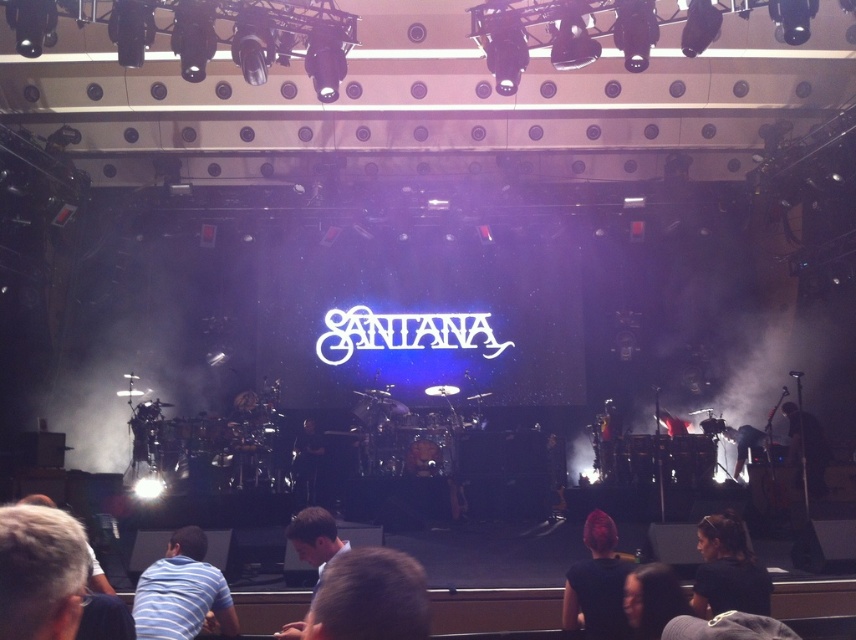
Does pink hair at center have a lesser height compared to light brown hair at lower center?

No.

Can you confirm if pink hair at center is positioned to the right of light brown hair at lower center?

Correct, you'll find pink hair at center to the right of light brown hair at lower center.

Who is more forward, (583, 589) or (295, 632)?

Point (295, 632)

Image resolution: width=856 pixels, height=640 pixels. Identify the location of pink hair at center. 597,582.

Does striped shirt at lower left appear on the right side of light brown hair at lower center?

Incorrect, striped shirt at lower left is not on the right side of light brown hair at lower center.

Does striped shirt at lower left appear on the left side of light brown hair at lower center?

Correct, you'll find striped shirt at lower left to the left of light brown hair at lower center.

What are the coordinates of `striped shirt at lower left` in the screenshot? It's located at (182, 593).

In order to click on striped shirt at lower left in this screenshot , I will do `click(182, 593)`.

Between striped shirt at lower left and black leather guitar at center, which one is positioned higher?

Positioned higher is striped shirt at lower left.

Is point (143, 582) positioned in front of point (305, 472)?

Yes, point (143, 582) is in front of point (305, 472).

Locate an element on the screen. Image resolution: width=856 pixels, height=640 pixels. striped shirt at lower left is located at coordinates (182, 593).